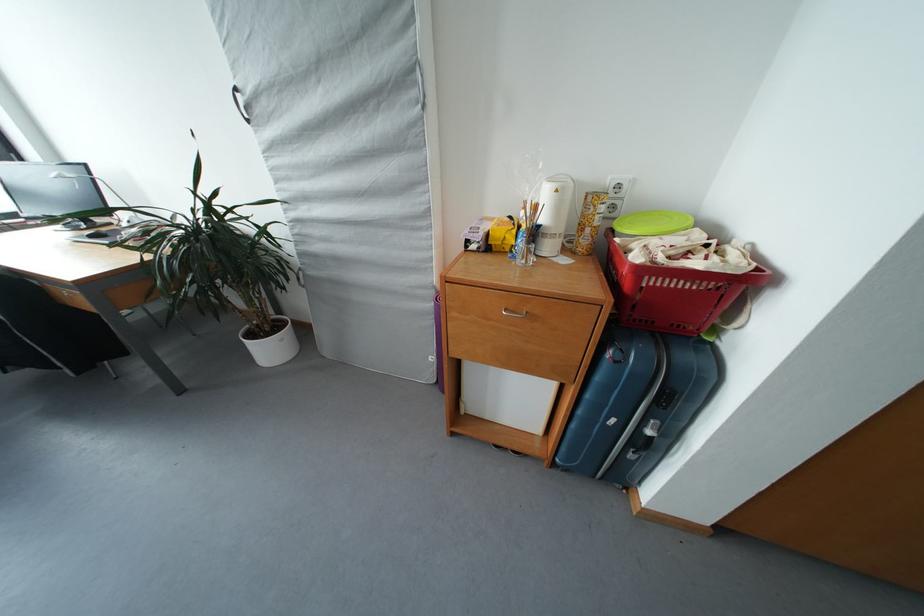
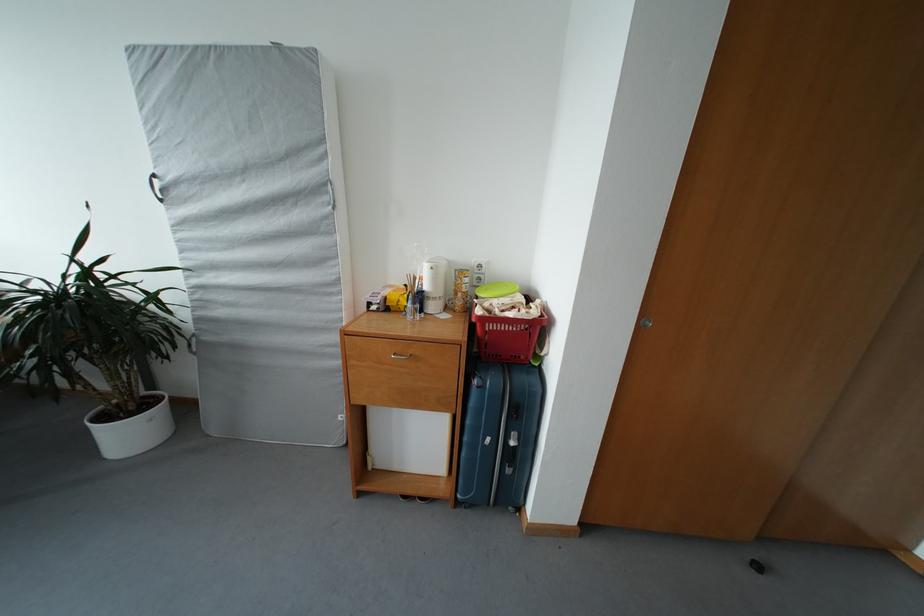
The images are taken continuously from a first-person perspective. In which direction are you moving?

The cameraman moved toward right, backward.